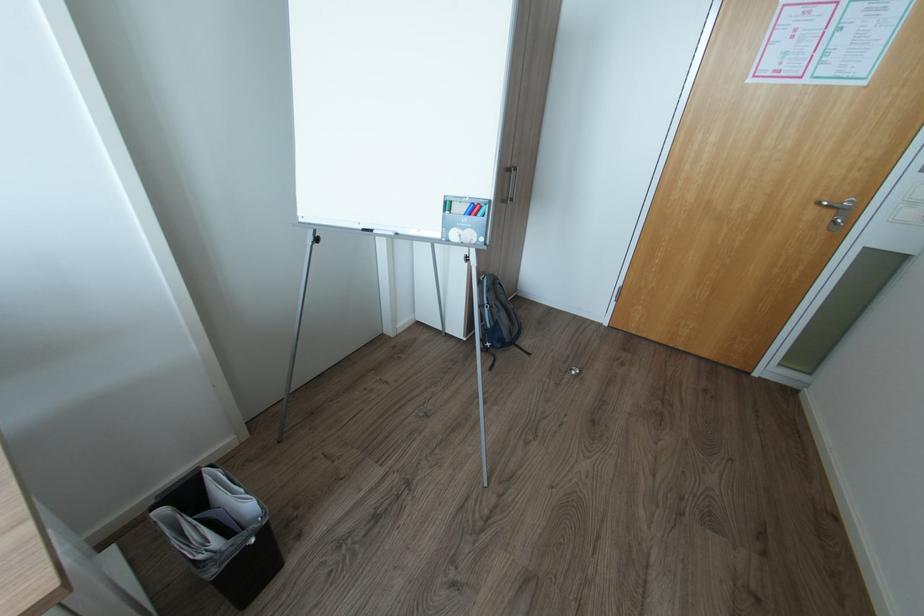
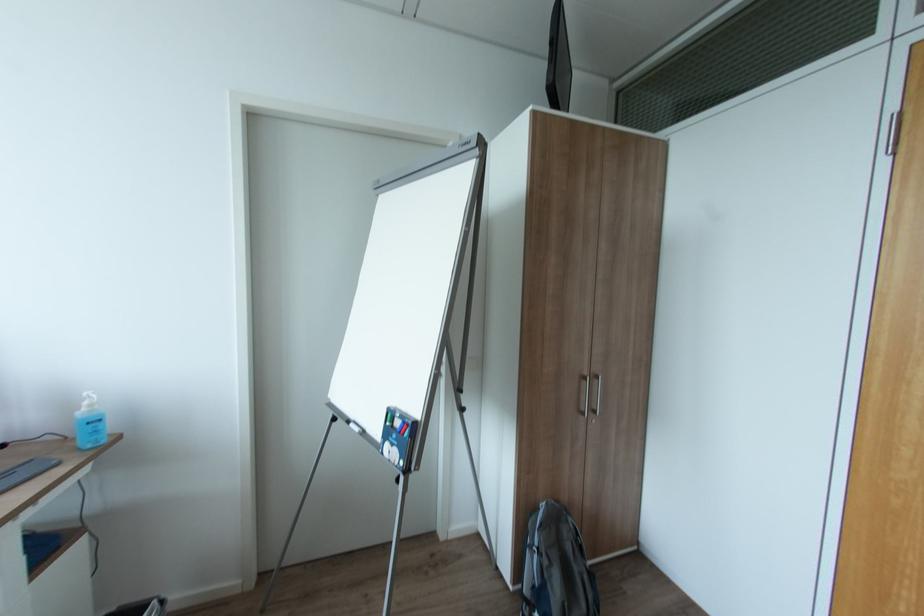
First-person continuous shooting, in which direction is the camera rotating?

The camera rotated toward left-up.